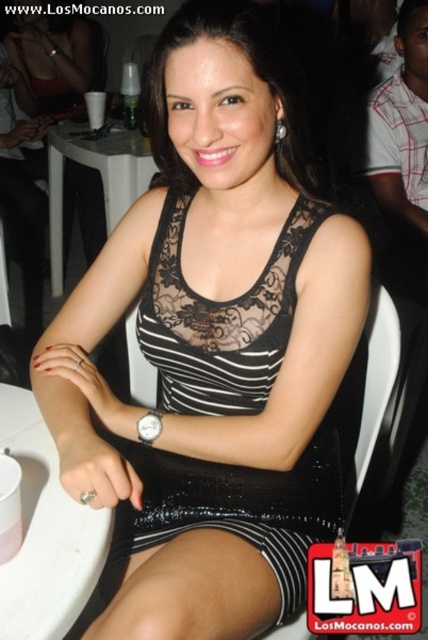
You are a photographer at a social event. You want to take a photo of the black sequined dress at center without including the white plastic table at center in the frame. Given that the distance between them is 4.87 feet, what is the minimum distance you need to stand from the dress to ensure the table is out of the shot?

The black sequined dress at center and white plastic table at center are 4.87 feet apart. To ensure the table is out of the shot, you need to stand at least 4.87 feet away from the dress.

You are a server at a restaurant and need to deliver a tray of drinks to the table. You are currently standing next to the white plastic table at lower left. Which table should you head to if the customer is seated at the white plastic table at center?

The white plastic table at center is 1.63 meters away from the white plastic table at lower left. Since you are already next to the white plastic table at lower left, you should head to the white plastic table at center to deliver the drinks.